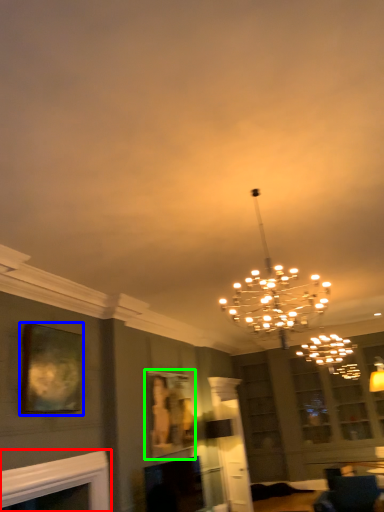
Question: Which object is the farthest from fireplace (highlighted by a red box)? Choose among these: picture frame (highlighted by a blue box) or picture frame (highlighted by a green box).

Choices:
 (A) picture frame
 (B) picture frame

Answer: (B)